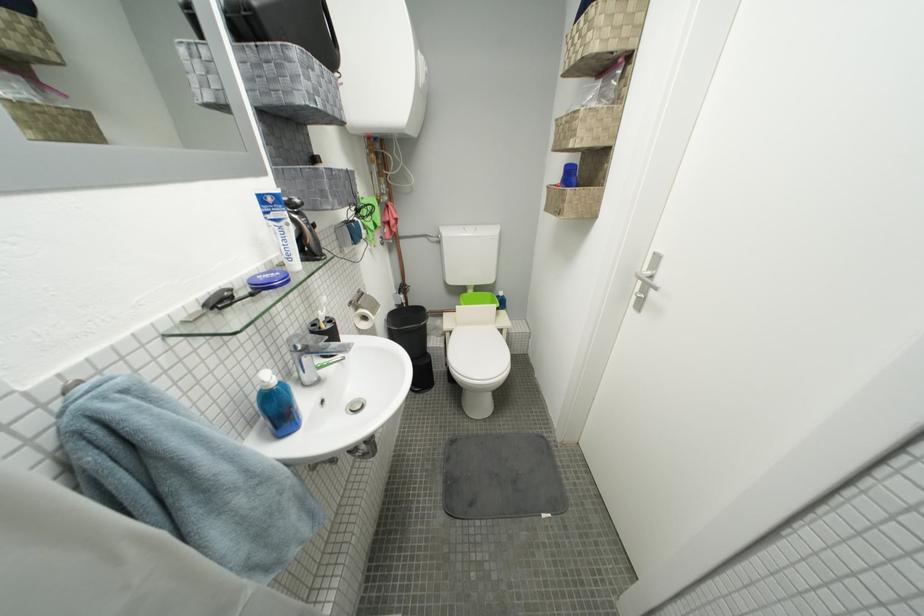
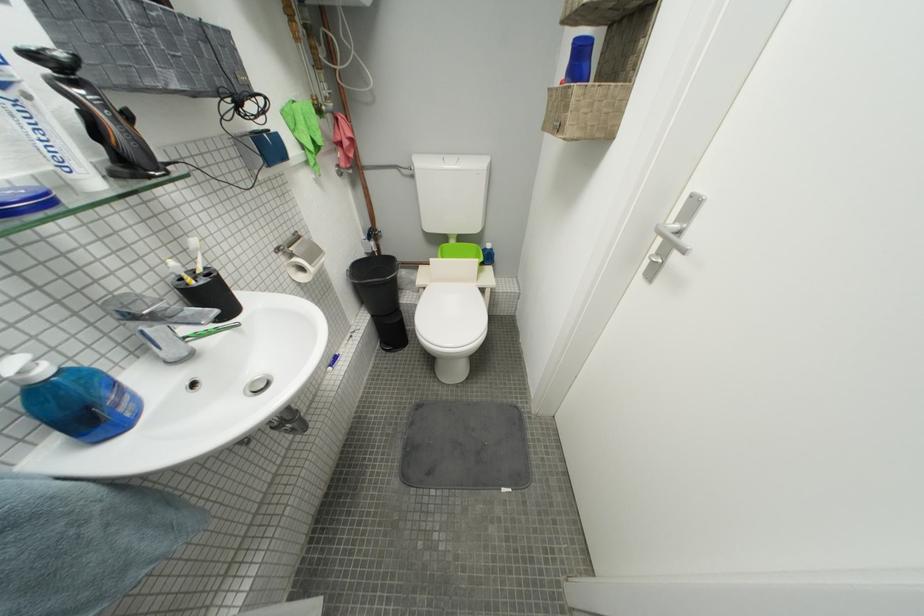
The images are taken continuously from a first-person perspective. In which direction are you moving?

The cameraman moved toward right, forward.